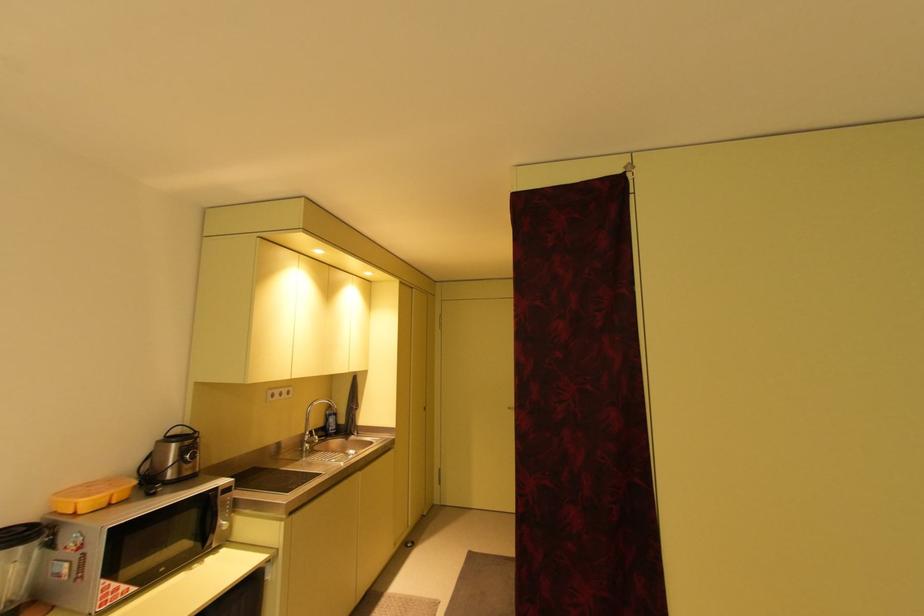
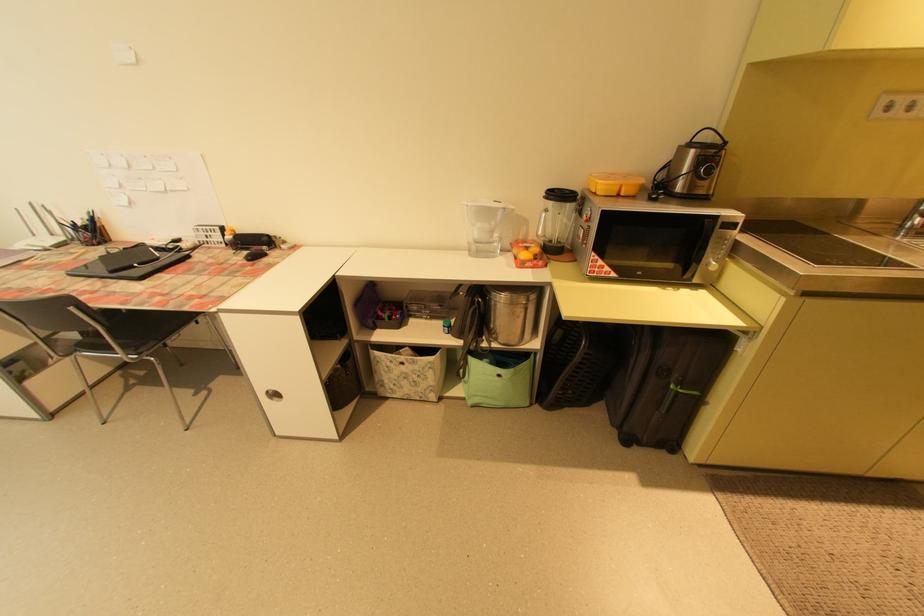
The point at (229, 525) is marked in the first image. Where is the corresponding point in the second image?

(720, 265)